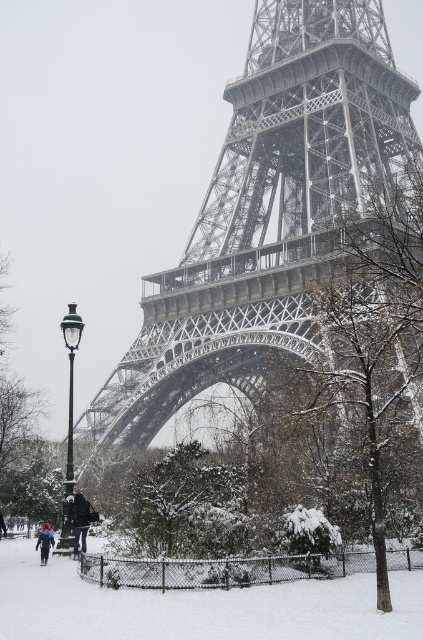
Who is lower down, metallic gray eiffel tower at center or black matte jacket at lower left?

black matte jacket at lower left is below.

Is point (305, 212) less distant than point (85, 520)?

No, (305, 212) is behind (85, 520).

Is point (198, 355) farther from camera compared to point (85, 515)?

That is True.

Identify the location of metallic gray eiffel tower at center. Image resolution: width=423 pixels, height=640 pixels. (266, 212).

Between point (332, 163) and point (46, 554), which one is positioned behind?

Positioned behind is point (332, 163).

Does metallic gray eiffel tower at center have a smaller size compared to snow-covered snowboarder at lower left?

Actually, metallic gray eiffel tower at center might be larger than snow-covered snowboarder at lower left.

Find the location of a particular element. metallic gray eiffel tower at center is located at coordinates (266, 212).

Does black matte jacket at lower left have a greater width compared to snow-covered snowboarder at lower left?

No.

Measure the distance between black matte jacket at lower left and camera.

The distance of black matte jacket at lower left from camera is 243.09 feet.

Image resolution: width=423 pixels, height=640 pixels. I want to click on black matte jacket at lower left, so click(80, 518).

This screenshot has height=640, width=423. I want to click on black matte jacket at lower left, so click(x=80, y=518).